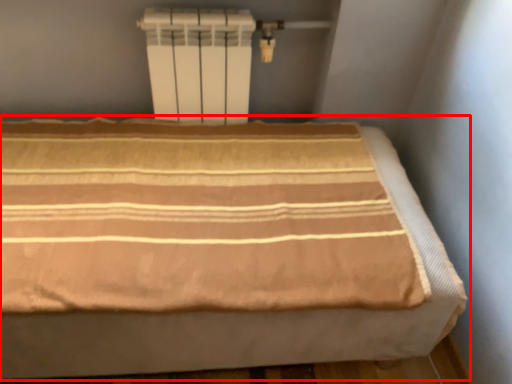
Question: Considering the relative positions of bed (annotated by the red box) and water heater in the image provided, where is bed (annotated by the red box) located with respect to the staircase?

Choices:
 (A) left
 (B) right

Answer: (A)